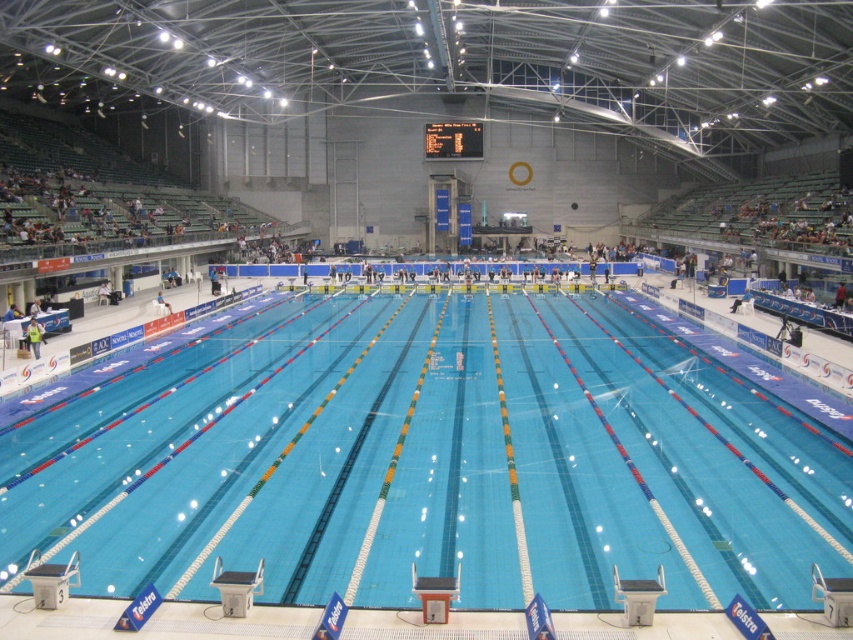
You are a swimmer preparing to dive into the pool. You notice the clear blue water at center and the light blue fabric shirt at lower left. Which object has a greater width from your perspective?

The clear blue water at center has a greater width than the light blue fabric shirt at lower left according to the description.

You are a swimmer preparing to dive into the pool. You see the clear blue water at center and the light blue fabric shirt at lower left. Which object is closer to the diving board?

The light blue fabric shirt at lower left is closer to the diving board because the clear blue water at center is located below it, indicating it is further away from the starting position.